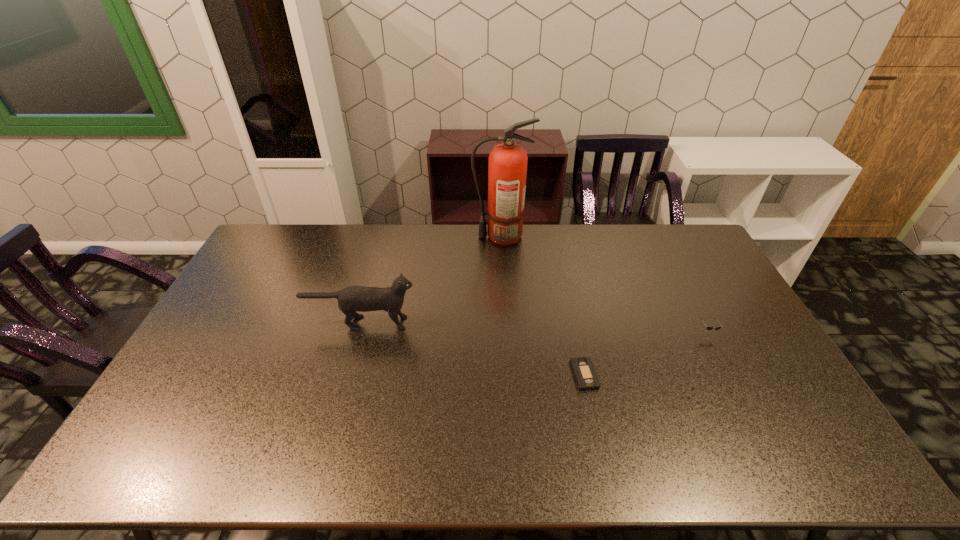
Find the location of a particular element. This screenshot has width=960, height=540. free point at the far right corner is located at coordinates (690, 227).

You are a GUI agent. You are given a task and a screenshot of the screen. Output one action in this format:
    pyautogui.click(x=<x>, y=<y>)
    Task: Click on the vacant space at the near right corner of the desktop
    The height and width of the screenshot is (540, 960).
    Given the screenshot: What is the action you would take?
    pyautogui.click(x=812, y=460)

The image size is (960, 540). I want to click on empty location between the rightmost object and the second tallest object, so click(x=535, y=327).

Find the location of `free spot between the third shortest object and the sunglasses`. free spot between the third shortest object and the sunglasses is located at coordinates (535, 327).

Where is `free space between the sunglasses and the videotape`? Image resolution: width=960 pixels, height=540 pixels. free space between the sunglasses and the videotape is located at coordinates (646, 353).

This screenshot has height=540, width=960. Find the location of `unoccupied area between the third object from right to left and the videotape`. unoccupied area between the third object from right to left and the videotape is located at coordinates (542, 306).

Locate an element on the screen. Image resolution: width=960 pixels, height=540 pixels. blank region between the videotape and the tallest object is located at coordinates (542, 306).

The width and height of the screenshot is (960, 540). I want to click on empty space between the sunglasses and the third object from left to right, so click(x=646, y=353).

Image resolution: width=960 pixels, height=540 pixels. Find the location of `free point between the nearest object and the rightmost object`. free point between the nearest object and the rightmost object is located at coordinates (646, 353).

At what (x,y) coordinates should I click in order to perform the action: click on empty space between the third object from left to right and the third tallest object. Please return your answer as a coordinate pair (x, y). Looking at the image, I should click on (646, 353).